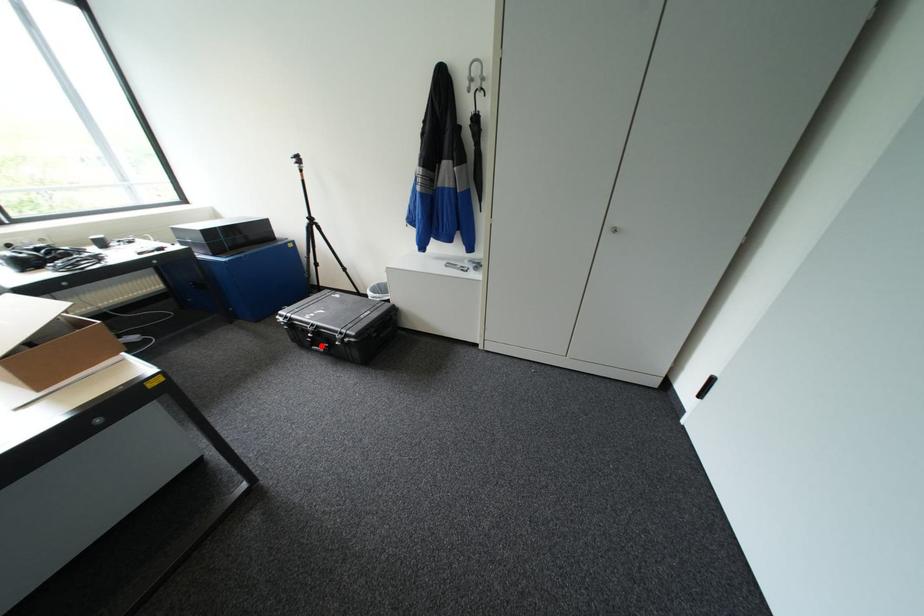
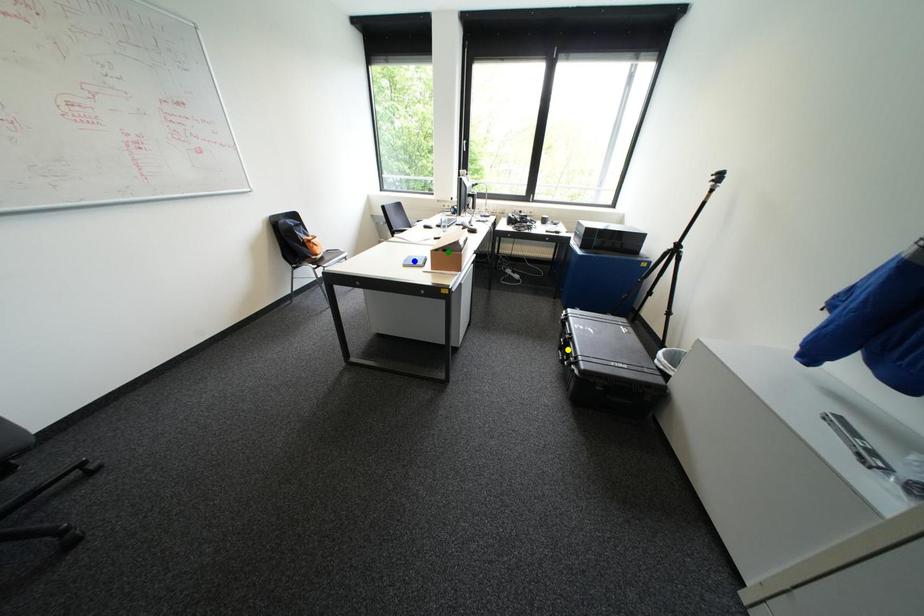
Question: I am providing you with two images of the same scene from different viewpoints. A red point is marked on the first image. You are given multiple points on the second image. Can you choose the point in image 2 that corresponds to the point in image 1?

Choices:
 (A) green point
 (B) yellow point
 (C) blue point

Answer: (B)